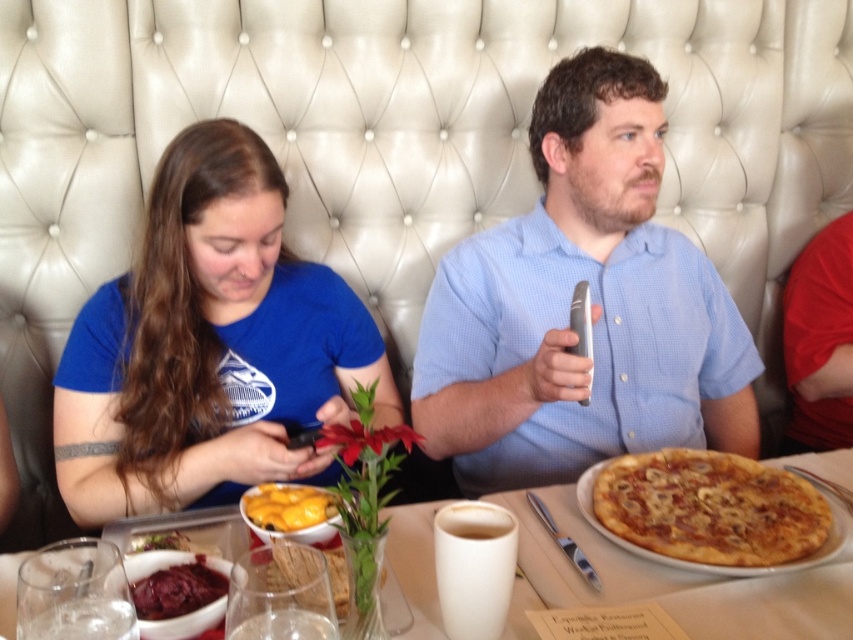
You are sitting at the table in the restaurant scene. There are two points marked on the table. One is at coordinates point (781,544) and the other is at point (287,524). If you want to place a napkin between them so it is closer to the one behind, which point should you place it nearest to?

Point (781,544) is behind point (287,524). To place the napkin closer to the one behind, you should place it nearest to point (781,544).

You are a food critic evaluating the presentation of dishes at the restaurant. You notice two central elements on the table, the golden brown crust at center and the yellow matte cheese at center. Which of these two items is visually more prominent in terms of size?

The golden brown crust at center is larger in size than the yellow matte cheese at center, making it the more prominent visual element between the two.